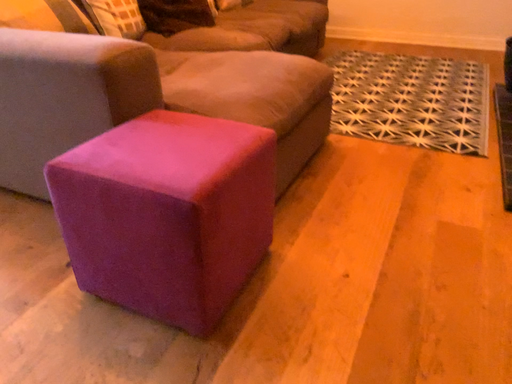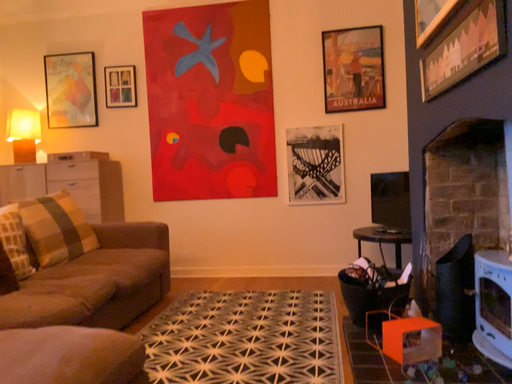
Question: Which way did the camera rotate in the video?

Choices:
 (A) rotated right
 (B) rotated left

Answer: (A)